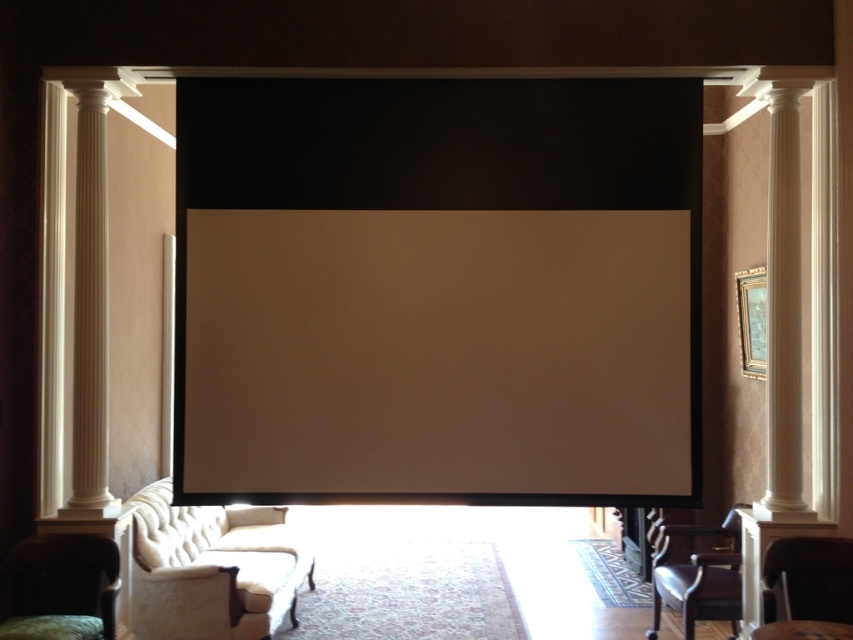
You are a delivery person who needs to place a large sofa that is 3.5 meters long into the living room. You see the white glossy column at left and the dark brown leather armchair at lower right. Can you fit the sofa between them without moving any existing furniture?

The distance between the white glossy column at left and the dark brown leather armchair at lower right is 3.49 meters, which is slightly shorter than the sofa length of 3.5 meters. Therefore, the sofa cannot be placed between them without moving existing furniture.

You are a delivery person carrying a large package that is 24 inches wide. You need to navigate through the space between the white smooth column at right and the matte white armchair at lower right. Can you pass through this space with your package?

The distance between the white smooth column at right and the matte white armchair at lower right is 22.20 inches, which is narrower than the 24 inches width of your package. Therefore, you cannot pass through this space with your package.